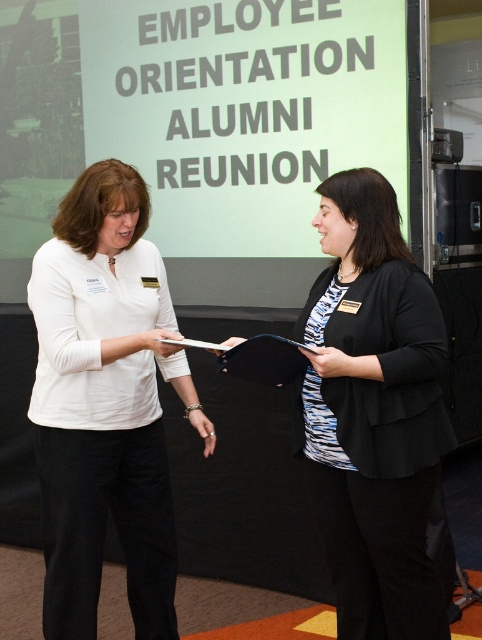
Question: Can you confirm if white matte shirt at center is positioned below black matte folder at center?

Choices:
 (A) no
 (B) yes

Answer: (B)

Question: Considering the real-world distances, which object is closest to the black matte blazer at center?

Choices:
 (A) white matte shirt at center
 (B) black matte folder at center

Answer: (B)

Question: Which object appears farthest from the camera in this image?

Choices:
 (A) black matte folder at center
 (B) white matte shirt at center
 (C) black matte blazer at center

Answer: (B)

Question: Which point appears farthest from the camera in this image?

Choices:
 (A) (230, 369)
 (B) (66, 602)
 (C) (348, 461)

Answer: (A)

Question: Can you confirm if white matte shirt at center is smaller than black matte folder at center?

Choices:
 (A) no
 (B) yes

Answer: (A)

Question: Is black matte blazer at center further to the viewer compared to black matte folder at center?

Choices:
 (A) no
 (B) yes

Answer: (A)